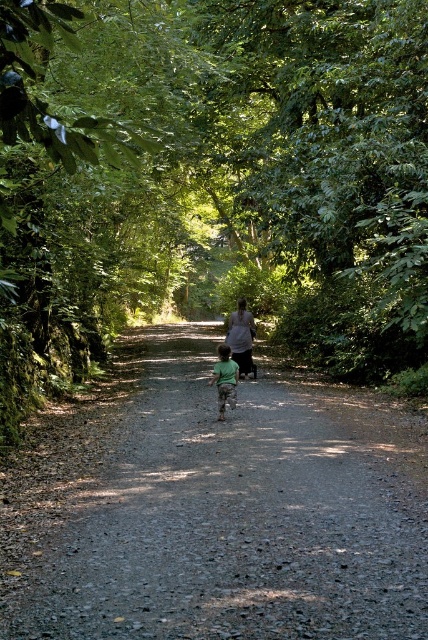
Based on the photo, you are a hiker walking on the forest path and you see the green leafy tree at center and the green matte shirt at center. Which object is higher from the ground?

The green leafy tree at center is positioned over the green matte shirt at center, so the green leafy tree at center is higher from the ground.

You are a hiker carrying a backpack and need to walk along the gravelly dirt path at center while avoiding stepping on the matte gray shirt at center. Since you must stay on the path, can you maneuver around the shirt without going off the path?

The gravelly dirt path at center is wider than the matte gray shirt at center, so yes, you can maneuver around the shirt while staying on the path.

You are walking along the forest path and see a green leafy tree at center and a green matte shirt at center. Which object is positioned more to the right from your perspective?

The green leafy tree at center is positioned to the right of the green matte shirt at center, so the green leafy tree at center is more to the right.